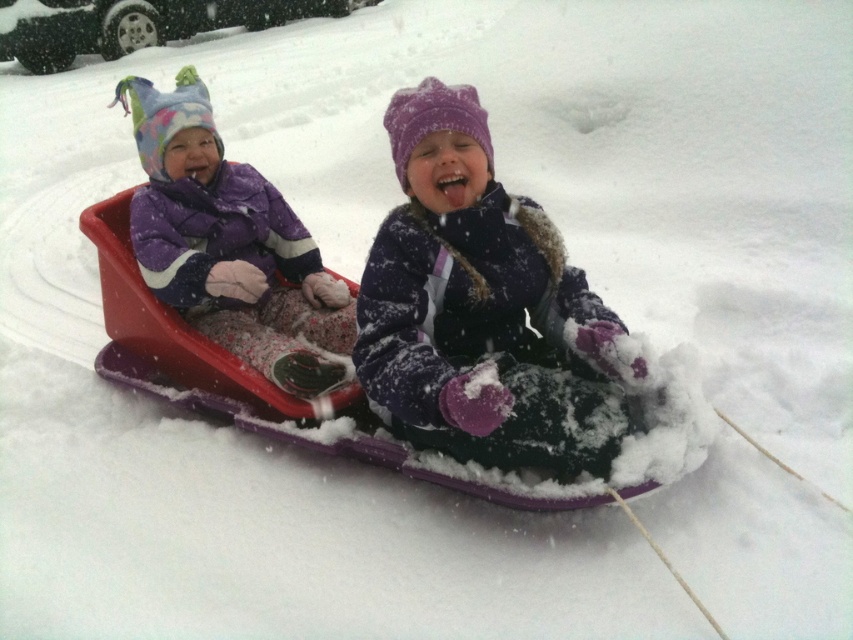
Question: Is purple fuzzy coat at center smaller than matte purple snowsuit at left?

Choices:
 (A) no
 (B) yes

Answer: (B)

Question: Where is purple fuzzy coat at center located in relation to matte purple snowsuit at left in the image?

Choices:
 (A) above
 (B) below

Answer: (B)

Question: From the image, what is the correct spatial relationship of purple fuzzy coat at center in relation to matte purple snowsuit at left?

Choices:
 (A) left
 (B) right

Answer: (B)